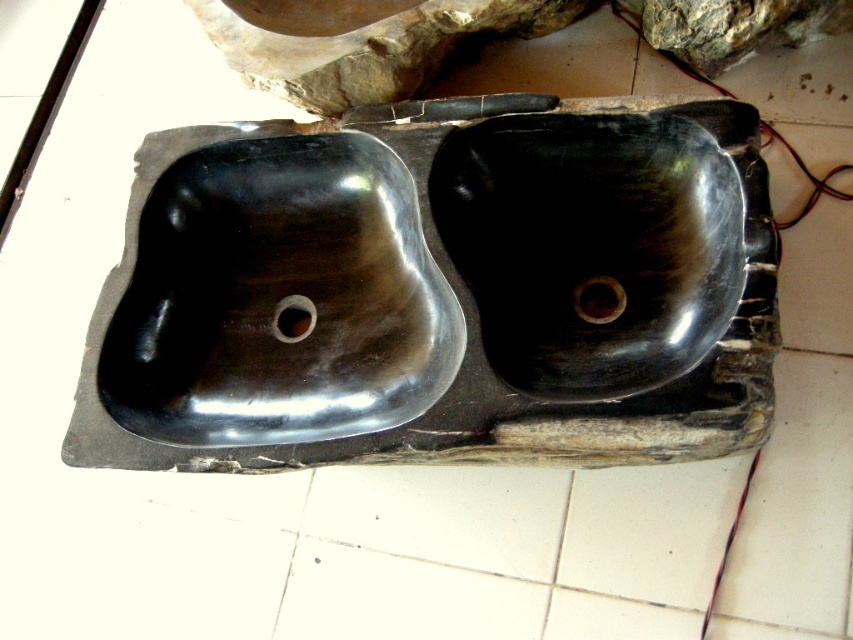
You are a plumber inspecting a bathroom and notice the black polished sink at center and the black rubber drain at center. Which object is wider?

The black polished sink at center is wider than the black rubber drain at center.

You are a plumber who needs to install a pipe connecting the two black polished sinks at center. The pipes you have are 3 feet long. Will the pipes be long enough?

The black polished sinks at center are 3.58 feet apart. The pipes you have are only 3 feet long, so they are not long enough to connect the two sinks.

You are a plumber inspecting the plumbing system in a bathroom. You notice two components at the center of the area. Which one is closer to you, the black polished sinks at center or the black rubber drain at center?

The black polished sinks at center is closer to you because it is in front of the black rubber drain at center.